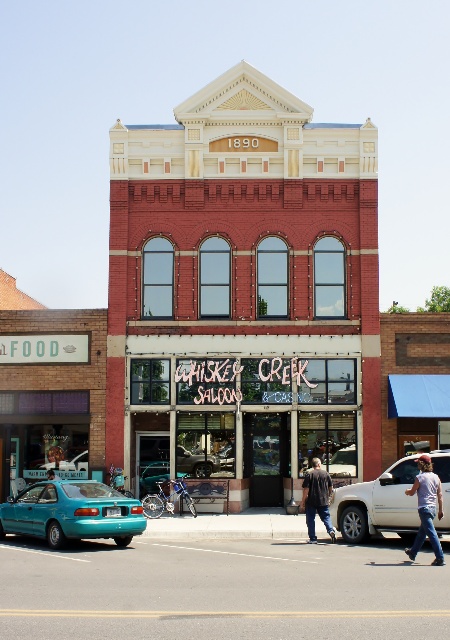
Question: Does white matte truck at center appear over denim jeans at lower right?

Choices:
 (A) yes
 (B) no

Answer: (B)

Question: Can you confirm if teal matte car at lower left is smaller than denim jeans at lower right?

Choices:
 (A) no
 (B) yes

Answer: (B)

Question: Which object is farther from the camera taking this photo?

Choices:
 (A) white matte truck at center
 (B) denim jeans at lower right
 (C) brown textured jacket at center

Answer: (C)

Question: Which point is farther from the camera taking this photo?

Choices:
 (A) (43, 518)
 (B) (309, 516)
 (C) (421, 522)
 (D) (356, 541)

Answer: (B)

Question: Can you confirm if white matte truck at center is bigger than denim jeans at lower right?

Choices:
 (A) no
 (B) yes

Answer: (A)

Question: Which of the following is the farthest from the observer?

Choices:
 (A) white matte truck at center
 (B) denim jeans at lower right

Answer: (A)